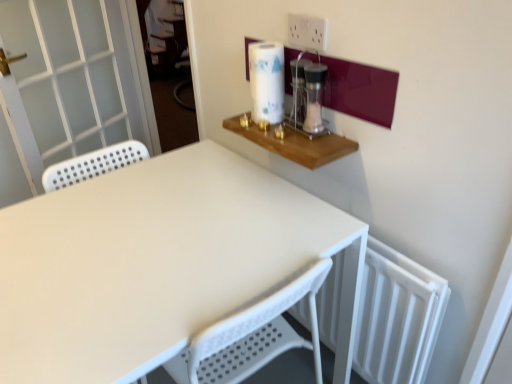
Question: From a real-world perspective, is white matte table at center above or below clear glass jar at upper right?

Choices:
 (A) above
 (B) below

Answer: (B)

Question: Considering the positions of white matte table at center and clear glass jar at upper right in the image, is white matte table at center taller or shorter than clear glass jar at upper right?

Choices:
 (A) tall
 (B) short

Answer: (A)

Question: Which of these objects is positioned farthest from the white perforated screen door at left?

Choices:
 (A) white matte table at center
 (B) white glossy paper towel at upper right
 (C) white plastic electric outlet at upper center
 (D) clear glass jar at upper right
 (E) clear glass salt shaker at upper center

Answer: (C)

Question: Which object is the farthest from the white matte table at center?

Choices:
 (A) clear glass salt shaker at upper center
 (B) clear glass jar at upper right
 (C) white plastic electric outlet at upper center
 (D) white perforated screen door at left
 (E) white glossy paper towel at upper right

Answer: (D)